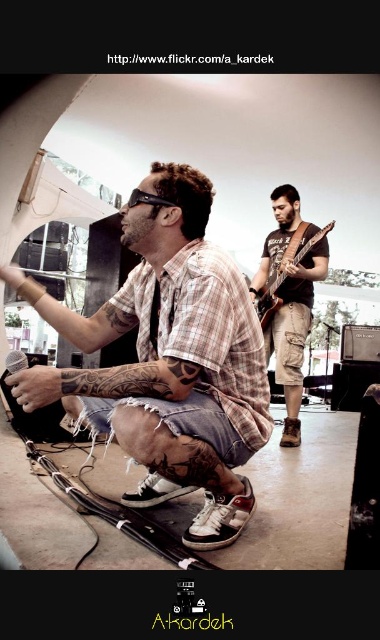
Question: Which of the following is the closest to the observer?

Choices:
 (A) (x=310, y=316)
 (B) (x=294, y=260)

Answer: (B)

Question: Can you confirm if plaid shirt at center is positioned to the right of wooden electric guitar at center?

Choices:
 (A) no
 (B) yes

Answer: (A)

Question: Does plaid shirt at center come behind brown leather guitar at center?

Choices:
 (A) yes
 (B) no

Answer: (B)

Question: Does brown leather guitar at center appear over wooden electric guitar at center?

Choices:
 (A) yes
 (B) no

Answer: (B)

Question: Which point is closer to the camera?

Choices:
 (A) (190, 444)
 (B) (305, 250)

Answer: (A)

Question: Which point appears closest to the camera in this image?

Choices:
 (A) (235, 524)
 (B) (321, 252)

Answer: (A)